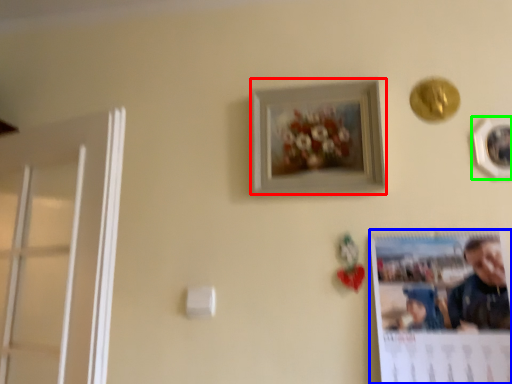
Question: Which is nearer to the picture frame (highlighted by a red box)? poster page (highlighted by a blue box) or picture frame (highlighted by a green box).

Choices:
 (A) poster page
 (B) picture frame

Answer: (A)